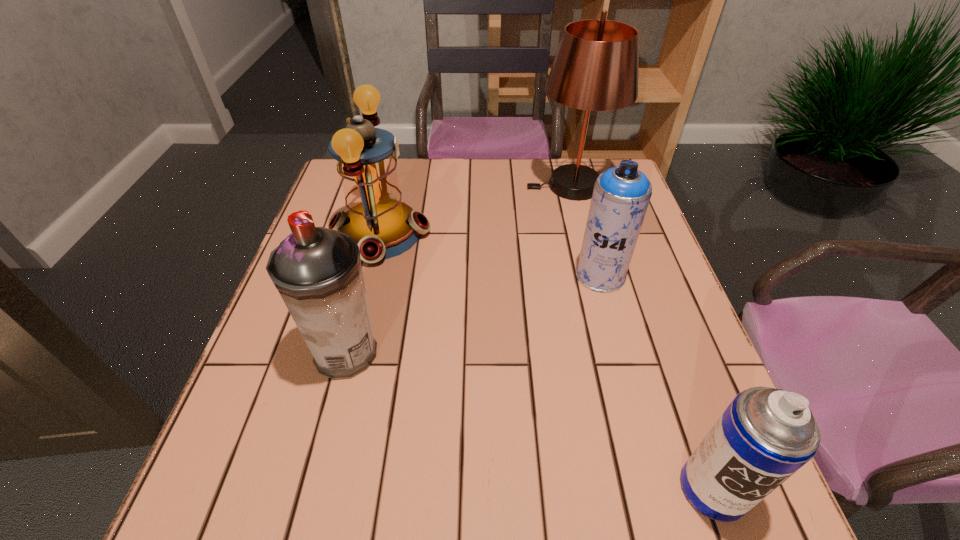
Where is `object present at the near right corner`? object present at the near right corner is located at coordinates (765, 435).

I want to click on vacant area at the far edge, so click(x=476, y=187).

The width and height of the screenshot is (960, 540). In the image, there is a desktop. What are the coordinates of `free space at the near edge` in the screenshot? It's located at (513, 498).

Identify the location of free space at the left edge of the desktop. The image size is (960, 540). (288, 393).

The width and height of the screenshot is (960, 540). I want to click on vacant space at the right edge of the desktop, so click(642, 382).

Image resolution: width=960 pixels, height=540 pixels. In the image, there is a desktop. Find the location of `vacant space at the far left corner`. vacant space at the far left corner is located at coordinates (332, 179).

Identify the location of free point at the near left corner. Image resolution: width=960 pixels, height=540 pixels. pos(203,502).

The width and height of the screenshot is (960, 540). I want to click on free spot between the lampshade and the second nearest object, so (x=459, y=269).

You are a GUI agent. You are given a task and a screenshot of the screen. Output one action in this format:
    pyautogui.click(x=<x>, y=<y>)
    Task: Click on the unoccupied area between the lampshade and the lantern
    The width and height of the screenshot is (960, 540).
    Given the screenshot: What is the action you would take?
    pyautogui.click(x=475, y=210)

The image size is (960, 540). Find the location of `free space between the farthest aerosol can and the leftmost aerosol can`. free space between the farthest aerosol can and the leftmost aerosol can is located at coordinates [473, 314].